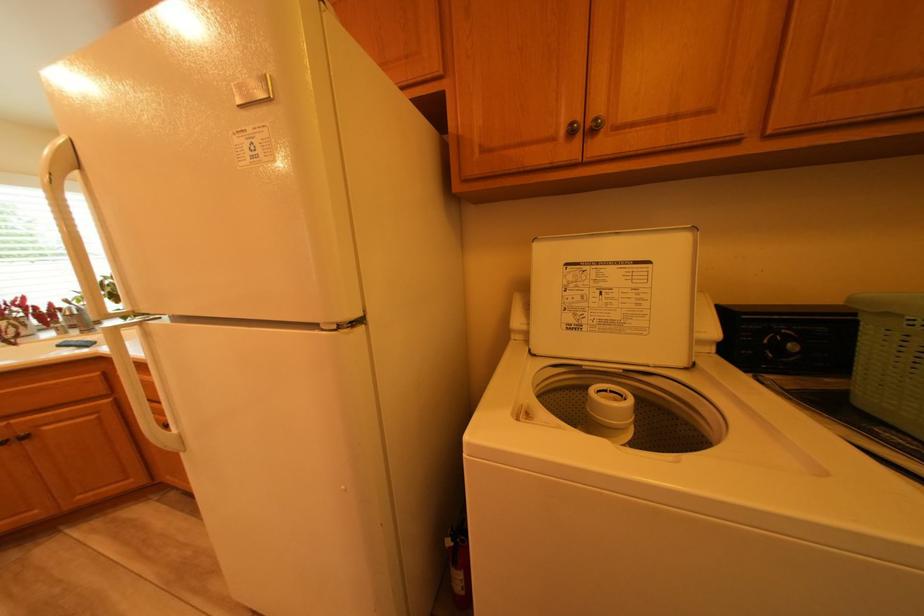
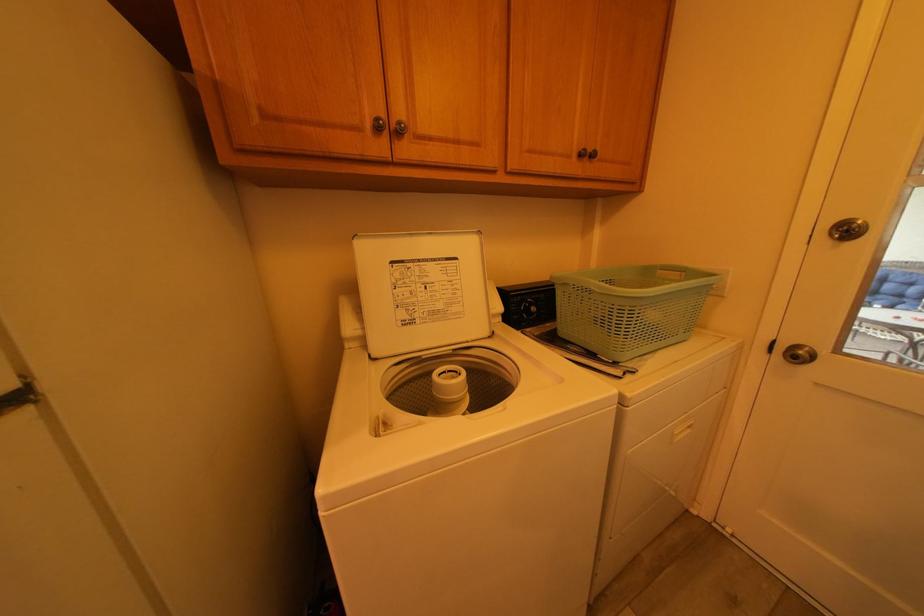
Question: Based on the continuous images, in which direction is the camera rotating? Reply with the corresponding letter.

Choices:
 (A) Left
 (B) Right
 (C) Up
 (D) Down

Answer: (B)